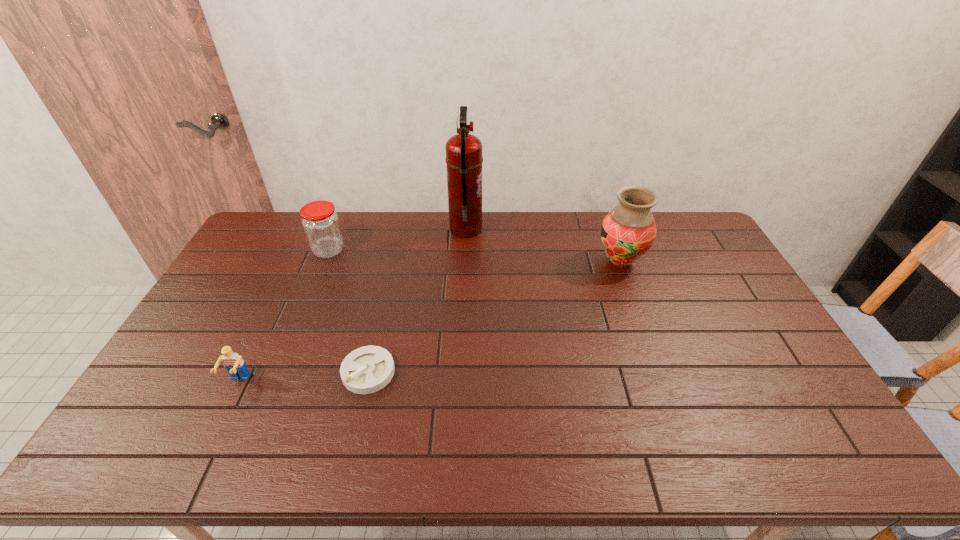
Where is `unoccupied area between the second shortest object and the second tallest object`? Image resolution: width=960 pixels, height=540 pixels. unoccupied area between the second shortest object and the second tallest object is located at coordinates (429, 321).

Locate an element on the screen. The width and height of the screenshot is (960, 540). empty space that is in between the fourth shortest object and the fire extinguisher is located at coordinates (543, 245).

The height and width of the screenshot is (540, 960). Identify the location of vacant area between the rightmost object and the third object from right to left. (494, 317).

Identify the location of object that can be found as the fourth closest to the fourth object from right to left. (628, 231).

Point out which object is positioned as the third nearest to the shortest object. Please provide its 2D coordinates. Your answer should be formatted as a tuple, i.e. [(x, y)], where the tuple contains the x and y coordinates of a point satisfying the conditions above.

[(464, 159)]

Locate an element on the screen. free space that satisfies the following two spatial constraints: 1. on the front side of the shortest object; 2. on the left side of the fourth object from right to left is located at coordinates (279, 372).

Find the location of `vacant position in the image that satisfies the following two spatial constraints: 1. on the front side of the third object from left to right; 2. on the right side of the jar`. vacant position in the image that satisfies the following two spatial constraints: 1. on the front side of the third object from left to right; 2. on the right side of the jar is located at coordinates (279, 372).

Where is `vacant area that satisfies the following two spatial constraints: 1. on the side of the tallest object with the handle and hose; 2. on the face of the leftmost object`? The width and height of the screenshot is (960, 540). vacant area that satisfies the following two spatial constraints: 1. on the side of the tallest object with the handle and hose; 2. on the face of the leftmost object is located at coordinates (460, 381).